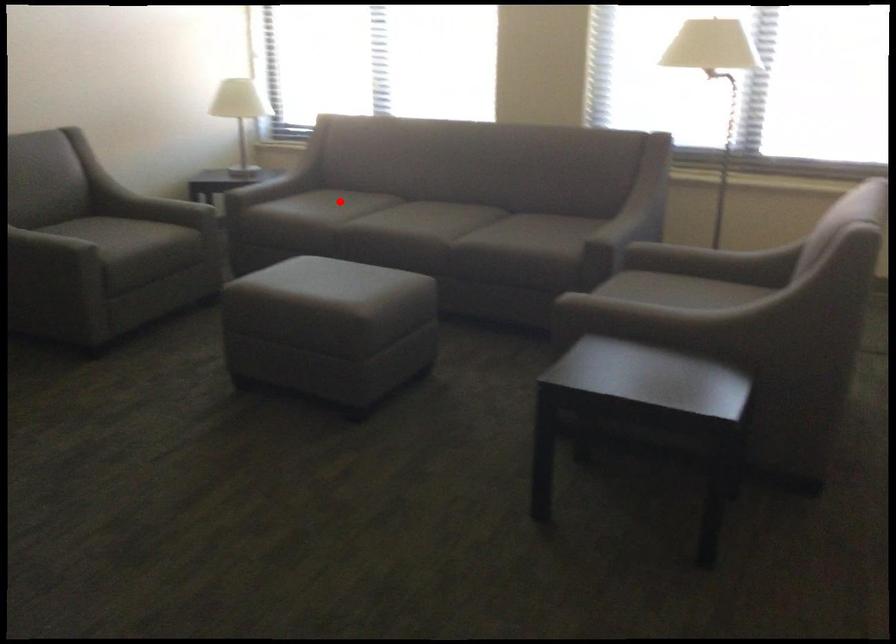
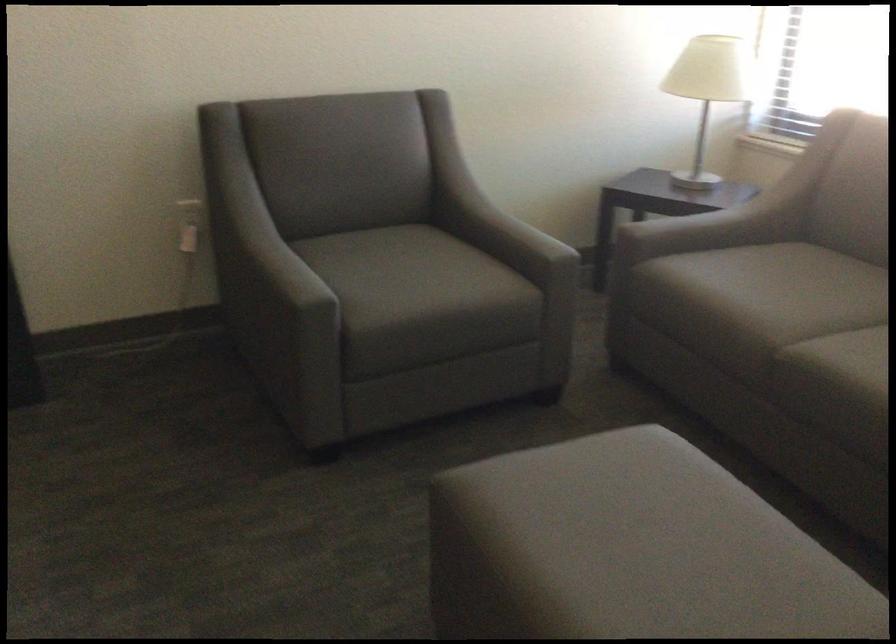
The point at the highlighted location is marked in the first image. Where is the corresponding point in the second image?

(797, 292)